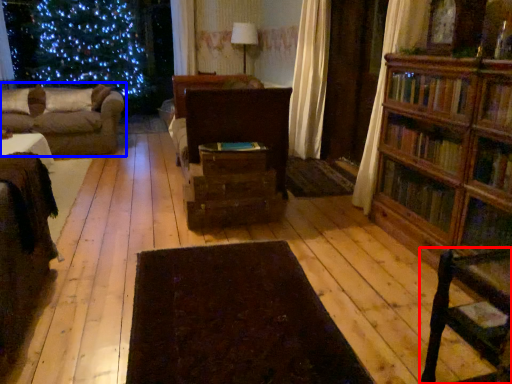
Question: Which object is closer to the camera taking this photo, chair (highlighted by a red box) or studio couch (highlighted by a blue box)?

Choices:
 (A) chair
 (B) studio couch

Answer: (A)